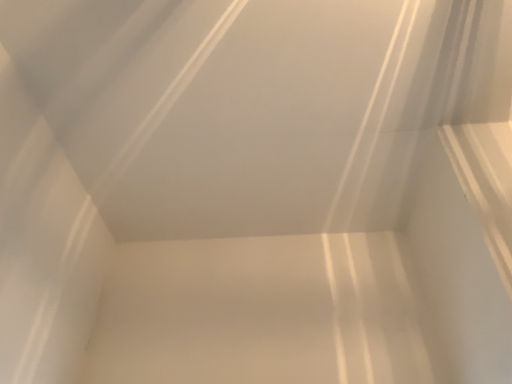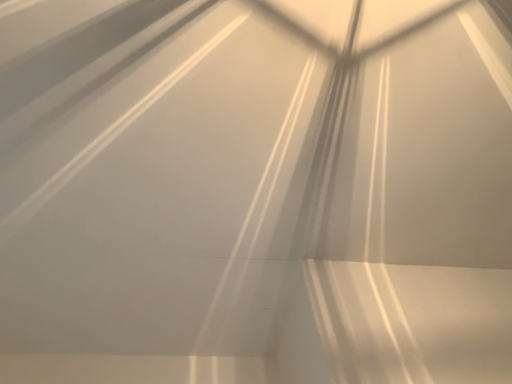
Question: Which way did the camera rotate in the video?

Choices:
 (A) rotated upward
 (B) rotated downward

Answer: (A)